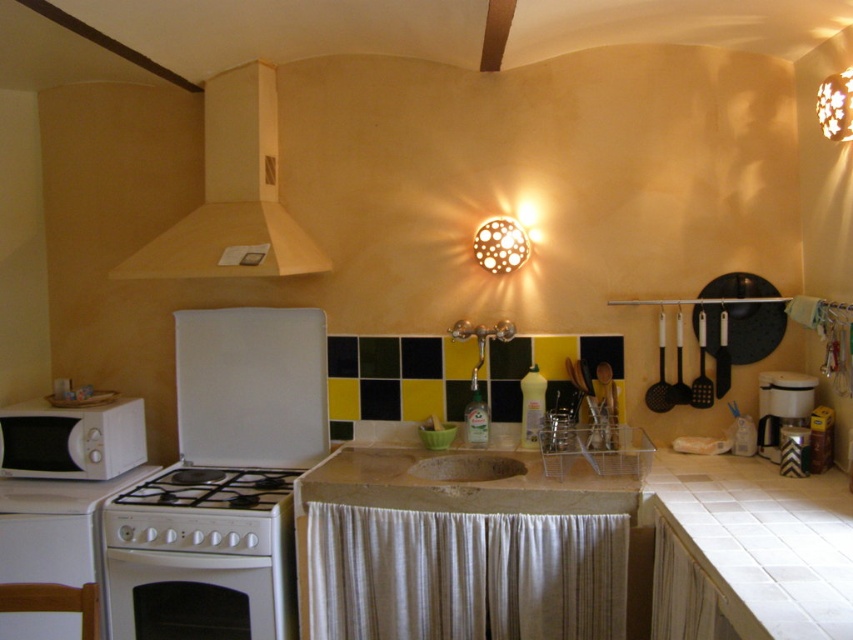
Can you confirm if white glossy oven at lower left is taller than white glossy gas stove at lower left?

Indeed, white glossy oven at lower left has a greater height compared to white glossy gas stove at lower left.

In the scene shown: Can you confirm if white glossy oven at lower left is wider than white glossy gas stove at lower left?

No.

Between point (141, 627) and point (122, 497), which one is positioned behind?

The point (122, 497) is behind.

Where is `white glossy oven at lower left`? The width and height of the screenshot is (853, 640). white glossy oven at lower left is located at coordinates (189, 595).

Is matte white exhaust hood at upper center taller than brown stone sink at center?

Indeed, matte white exhaust hood at upper center has a greater height compared to brown stone sink at center.

Does matte white exhaust hood at upper center have a smaller size compared to brown stone sink at center?

No, matte white exhaust hood at upper center is not smaller than brown stone sink at center.

This screenshot has height=640, width=853. Describe the element at coordinates (233, 195) in the screenshot. I see `matte white exhaust hood at upper center` at that location.

Identify the location of matte white exhaust hood at upper center. click(233, 195).

Who is taller, white glossy oven at lower left or white plastic coffee maker at right?

With more height is white glossy oven at lower left.

Locate an element on the screen. Image resolution: width=853 pixels, height=640 pixels. white glossy oven at lower left is located at coordinates (189, 595).

Who is more distant from viewer, (263, 637) or (785, 380)?

Point (785, 380)

Where is `white glossy oven at lower left`? This screenshot has height=640, width=853. white glossy oven at lower left is located at coordinates (189, 595).